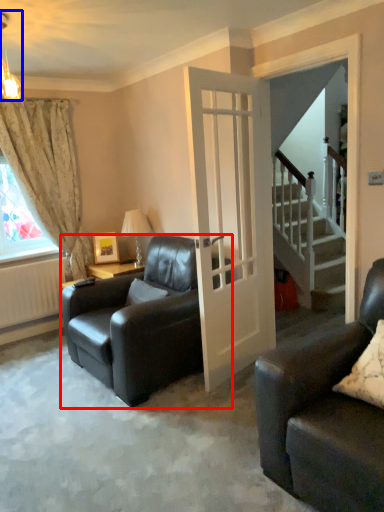
Question: Which point is closer to the camera, chair (highlighted by a red box) or light fixture (highlighted by a blue box)?

Choices:
 (A) chair
 (B) light fixture

Answer: (B)